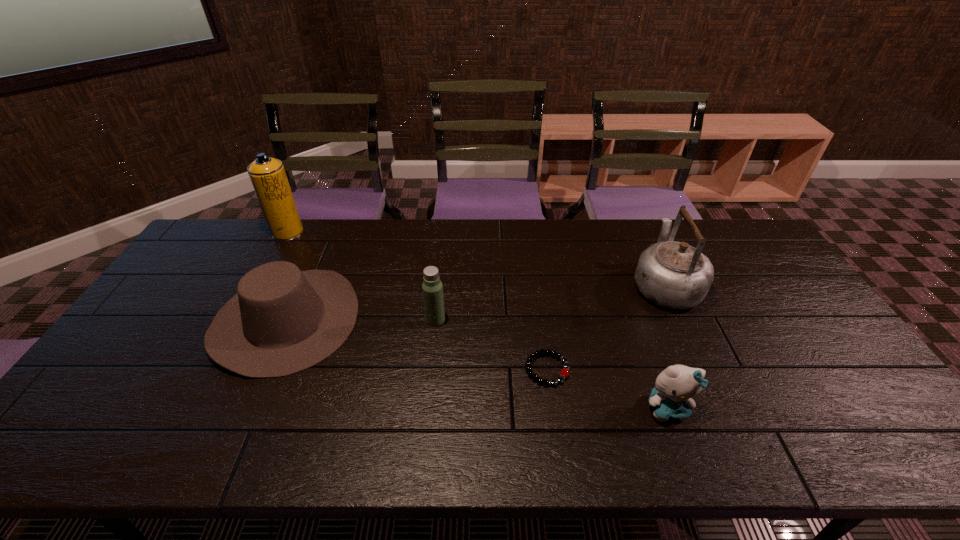
This screenshot has width=960, height=540. In order to click on blank area located 0.220m at the spout of the kettle in this screenshot , I will do `click(636, 220)`.

Locate an element on the screen. The height and width of the screenshot is (540, 960). vacant position located at the spout of the kettle is located at coordinates (639, 227).

Locate an element on the screen. Image resolution: width=960 pixels, height=540 pixels. vacant space located 0.070m on the front of the fourth shortest object is located at coordinates (433, 346).

Where is `free region located 0.330m on the right of the cowboy hat`? Image resolution: width=960 pixels, height=540 pixels. free region located 0.330m on the right of the cowboy hat is located at coordinates (470, 319).

This screenshot has width=960, height=540. What are the coordinates of `vacant space situated on the right of the bracelet` in the screenshot? It's located at (655, 369).

Locate an element on the screen. The image size is (960, 540). aerosol can located at the far edge is located at coordinates (268, 176).

I want to click on kettle located in the far edge section of the desktop, so click(x=675, y=275).

Identify the location of object positioned at the near edge. (675, 386).

Locate an element on the screen. vacant space at the far edge of the desktop is located at coordinates (602, 257).

Image resolution: width=960 pixels, height=540 pixels. I want to click on vacant region at the near edge of the desktop, so click(657, 427).